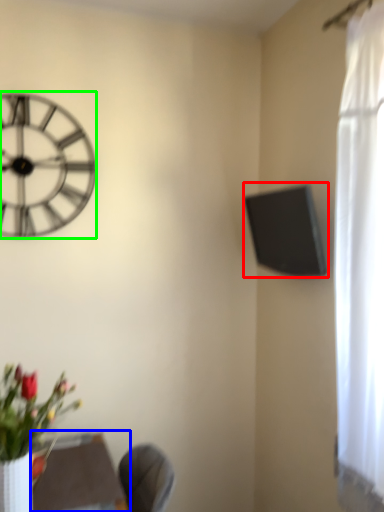
Question: Which is farther away from window screen (highlighted by a red box)? round table (highlighted by a blue box) or wall clock (highlighted by a green box)?

Choices:
 (A) round table
 (B) wall clock

Answer: (A)